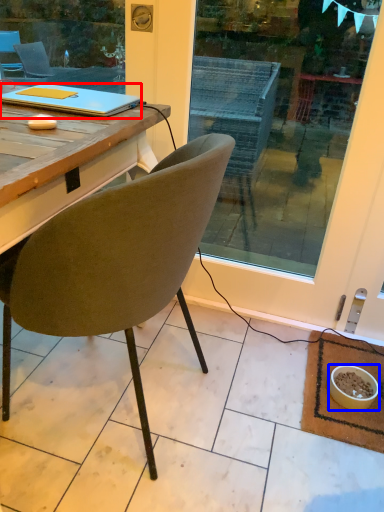
Question: Among these objects, which one is farthest to the camera, laptop (highlighted by a red box) or bowl (highlighted by a blue box)?

Choices:
 (A) laptop
 (B) bowl

Answer: (B)